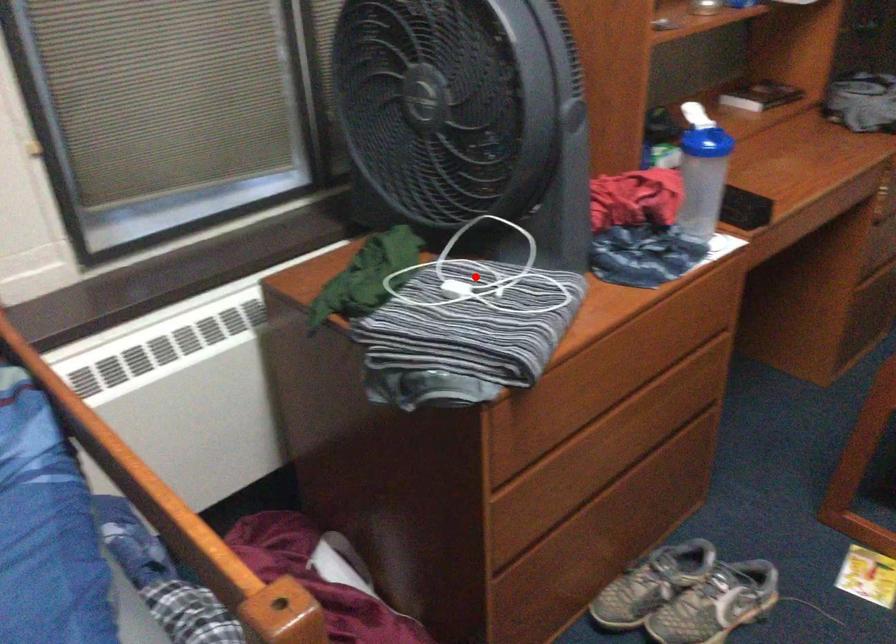
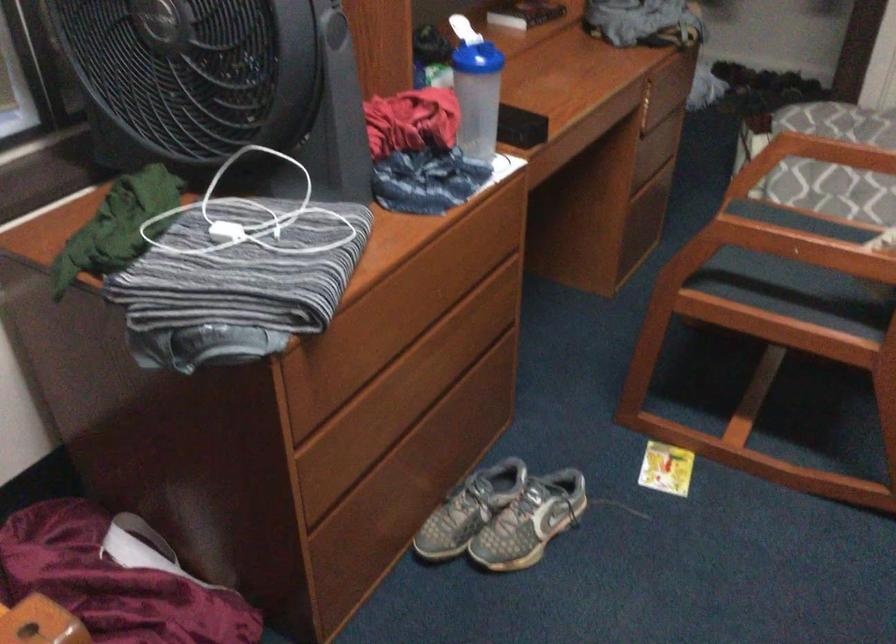
Question: I am providing you with two images of the same scene from different viewpoints. In image1, a red point is highlighted. Considering the same 3D point in image2, which of the following is correct?

Choices:
 (A) It is closer
 (B) It is farther

Answer: (A)